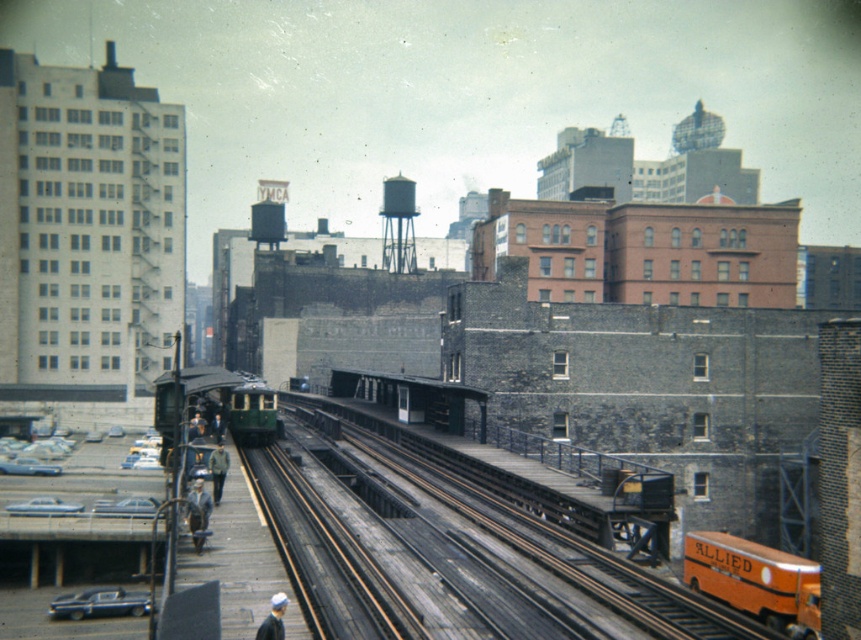
Question: Does metallic gray water tower at center come behind white fabric hat at lower center?

Choices:
 (A) yes
 (B) no

Answer: (A)

Question: Does smooth concrete track at center have a lesser width compared to green matte train at center?

Choices:
 (A) yes
 (B) no

Answer: (A)

Question: Based on their relative distances, which object is nearer to the khaki fabric jacket at center?

Choices:
 (A) light brown leather jacket at center
 (B) smooth concrete track at center
 (C) metallic gray water tower at center
 (D) green matte train at center

Answer: (A)

Question: Which is farther from the green matte train at center?

Choices:
 (A) orange matte bus at lower right
 (B) light brown leather jacket at center

Answer: (A)

Question: From the image, what is the correct spatial relationship of green matte train at center in relation to white fabric hat at lower center?

Choices:
 (A) above
 (B) below

Answer: (A)

Question: Which point is farther to the camera?

Choices:
 (A) (414, 189)
 (B) (808, 596)

Answer: (A)